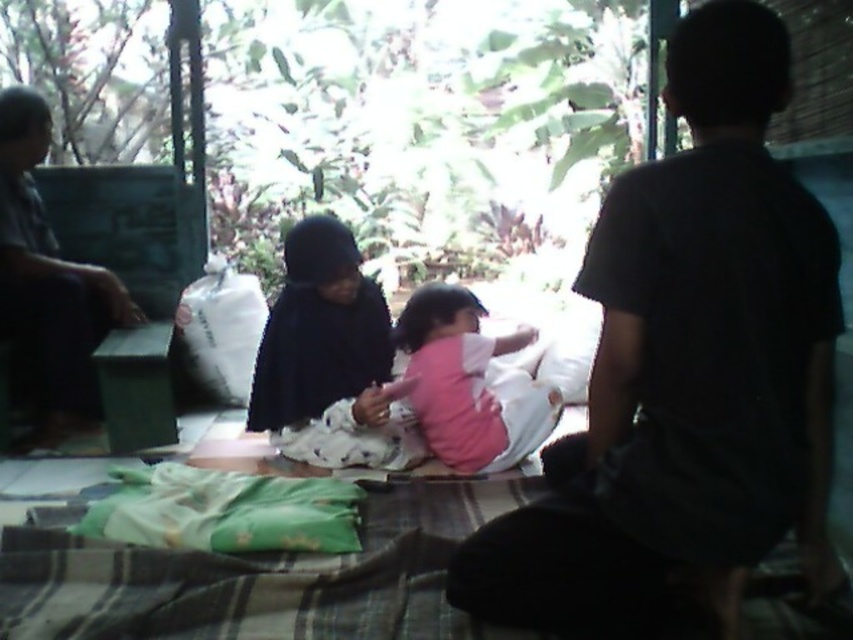
Question: Based on their relative distances, which object is farther from the black matte clothing at center?

Choices:
 (A) dark gray shirt at center
 (B) dark gray fabric at left
 (C) pink matte shirt at center

Answer: (A)

Question: Which object is farther from the camera taking this photo?

Choices:
 (A) pink matte shirt at center
 (B) dark gray shirt at center
 (C) black matte clothing at center
 (D) dark gray fabric at left

Answer: (D)

Question: Can you confirm if black matte clothing at center is bigger than pink matte shirt at center?

Choices:
 (A) yes
 (B) no

Answer: (B)

Question: Does dark gray shirt at center have a smaller size compared to pink matte shirt at center?

Choices:
 (A) no
 (B) yes

Answer: (A)

Question: Which object is closer to the camera taking this photo?

Choices:
 (A) dark gray fabric at left
 (B) pink matte shirt at center

Answer: (B)

Question: Considering the relative positions of dark gray fabric at left and pink matte shirt at center in the image provided, where is dark gray fabric at left located with respect to pink matte shirt at center?

Choices:
 (A) above
 (B) below

Answer: (A)